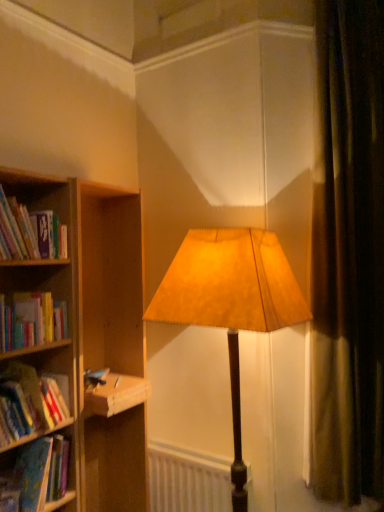
Question: In terms of width, does brown velvet curtain at right look wider or thinner when compared to hardcover book at left, which is the 2th book from top to bottom?

Choices:
 (A) thin
 (B) wide

Answer: (A)

Question: Is brown velvet curtain at right taller or shorter than hardcover book at left, the 3th book positioned from the bottom?

Choices:
 (A) short
 (B) tall

Answer: (B)

Question: Estimate the real-world distances between objects in this image. Which object is closer to the hardcover book at left, the 3th book positioned from the bottom?

Choices:
 (A) hardcover book at left, which is the third book from top to bottom
 (B) suede-like beige lampshade at center
 (C) hardcover book at left, the 4th book from the bottom
 (D) hardcover book at left, arranged as the fourth book when viewed from the top
 (E) brown velvet curtain at right

Answer: (A)

Question: Estimate the real-world distances between objects in this image. Which object is farther from the hardcover book at left, the 1th book positioned from the bottom?

Choices:
 (A) hardcover book at left, the 4th book from the bottom
 (B) hardcover book at left, which is the 2th book from top to bottom
 (C) hardcover book at left
 (D) hardcover book at left, which is the third book from top to bottom
 (E) white matte radiator at lower center

Answer: (A)